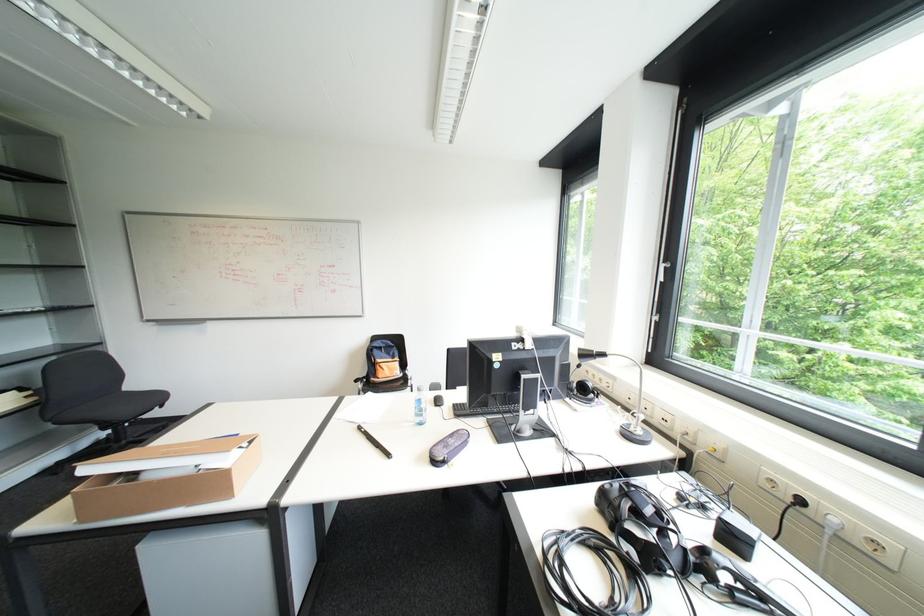
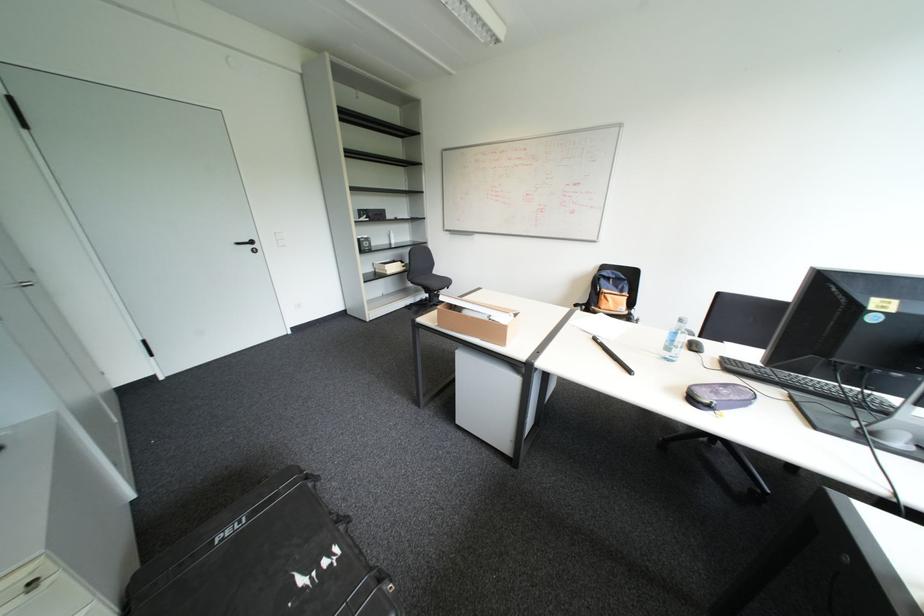
The images are taken continuously from a first-person perspective. In which direction is your viewpoint rotating?

The rotation direction of the camera is left-down.